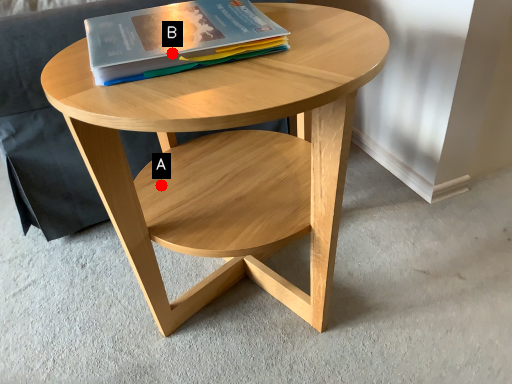
Question: Two points are circled on the image, labeled by A and B beside each circle. Among these points, which one is farthest from the camera?

Choices:
 (A) A is further
 (B) B is further

Answer: (A)